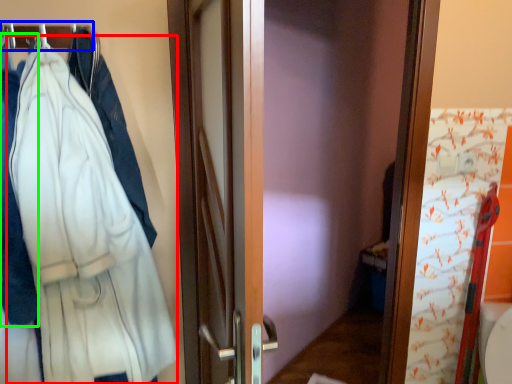
Question: Which is nearer to the bathrobe (highlighted by a red box)? hanger (highlighted by a blue box) or garment (highlighted by a green box).

Choices:
 (A) hanger
 (B) garment

Answer: (B)